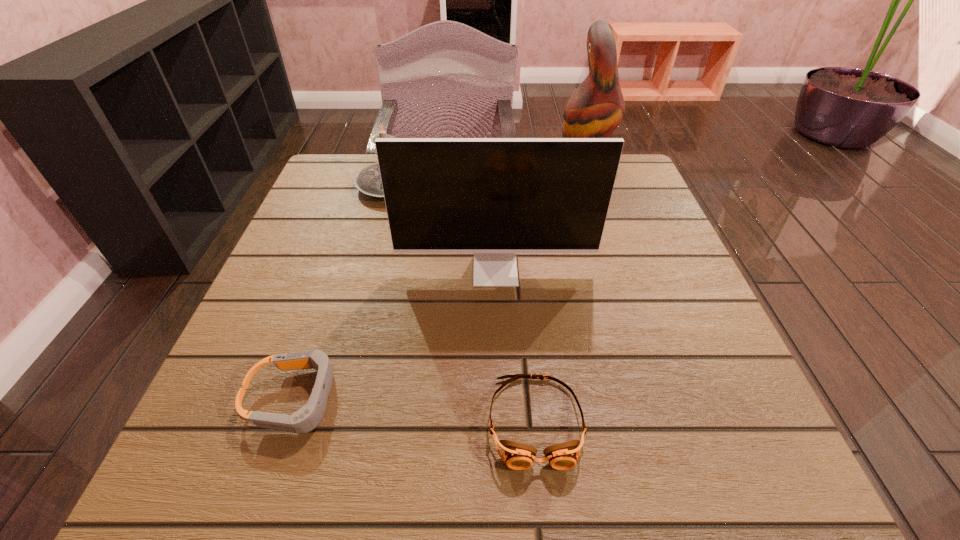
The width and height of the screenshot is (960, 540). Find the location of `the tallest object`. the tallest object is located at coordinates (595, 109).

Where is `monitor`? monitor is located at coordinates (494, 197).

At what (x,y) coordinates should I click in order to perform the action: click on the third nearest object. Please return your answer as a coordinate pair (x, y). Looking at the image, I should click on (494, 197).

I want to click on candle, so click(x=368, y=180).

Where is `the right goggles`? Image resolution: width=960 pixels, height=540 pixels. the right goggles is located at coordinates (517, 456).

You are a GUI agent. You are given a task and a screenshot of the screen. Output one action in this format:
    pyautogui.click(x=<x>, y=<y>)
    Task: Click on the left goggles
    The height and width of the screenshot is (540, 960).
    Given the screenshot: What is the action you would take?
    pyautogui.click(x=304, y=420)

This screenshot has height=540, width=960. Identify the location of vacant space located 0.330m on the face of the parrot. (426, 170).

Identify the location of blank space located on the face of the parrot. Image resolution: width=960 pixels, height=540 pixels. (524, 170).

Where is `blank area located 0.280m on the face of the parrot`? Image resolution: width=960 pixels, height=540 pixels. blank area located 0.280m on the face of the parrot is located at coordinates pos(445,170).

Where is `free spot located 0.100m on the front-facing side of the second tallest object`? free spot located 0.100m on the front-facing side of the second tallest object is located at coordinates (497, 328).